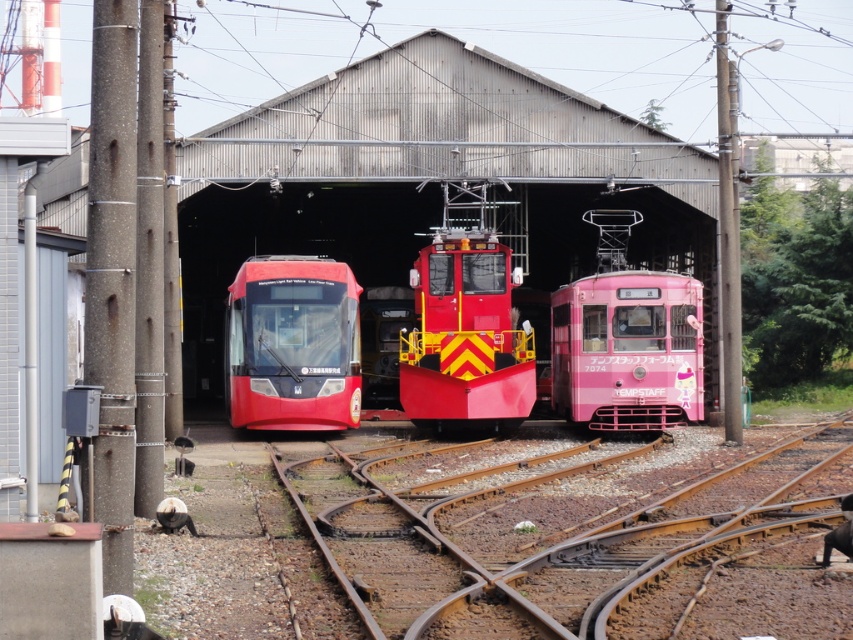
Who is positioned more to the left, brown metal train track at center or pink glossy tram at center?

Positioned to the left is brown metal train track at center.

Can you confirm if brown metal train track at center is wider than pink glossy tram at center?

Yes.

Who is more distant from viewer, (677, 442) or (697, 371)?

The point (697, 371) is more distant.

Locate an element on the screen. brown metal train track at center is located at coordinates (550, 522).

Is pink glossy tram at center further to camera compared to matte black train at center?

No, pink glossy tram at center is in front of matte black train at center.

Who is lower down, pink glossy tram at center or matte black train at center?

Positioned lower is pink glossy tram at center.

Which is in front, point (608, 416) or point (254, 292)?

Point (608, 416) is more forward.

The height and width of the screenshot is (640, 853). What are the coordinates of `pink glossy tram at center` in the screenshot? It's located at (627, 349).

Does brown metal train track at center have a greater width compared to matte black train at center?

Indeed, brown metal train track at center has a greater width compared to matte black train at center.

Does brown metal train track at center have a greater height compared to matte black train at center?

In fact, brown metal train track at center may be shorter than matte black train at center.

Who is more forward, (601,480) or (270,396)?

Positioned in front is point (601,480).

In order to click on brown metal train track at center in this screenshot , I will do `click(550, 522)`.